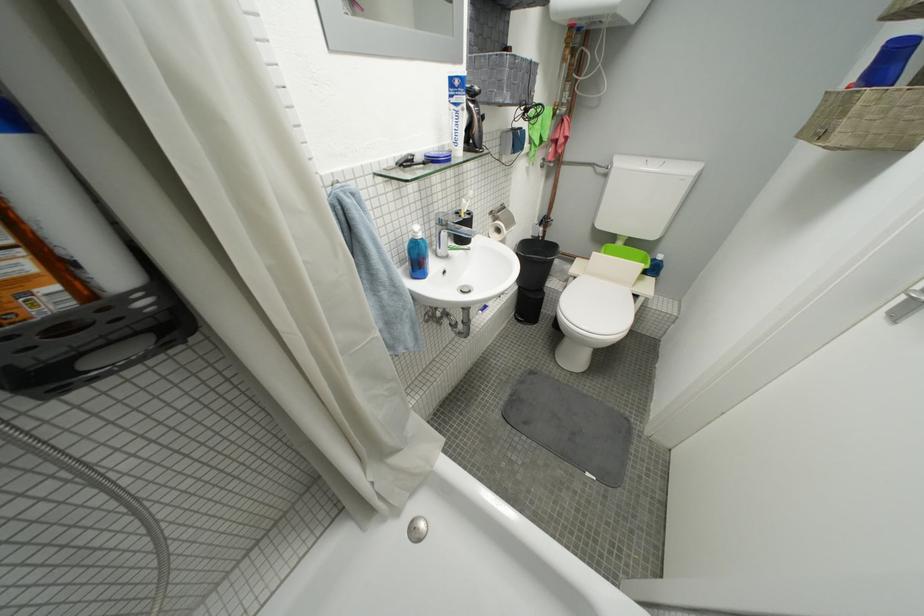
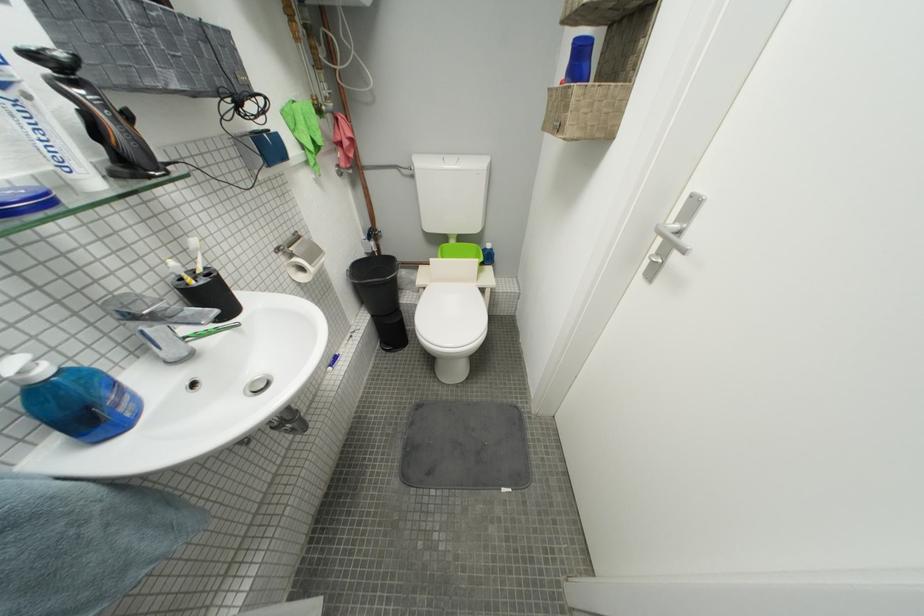
In the second image, find the point that corresponds to (x=488, y=116) in the first image.

(114, 108)